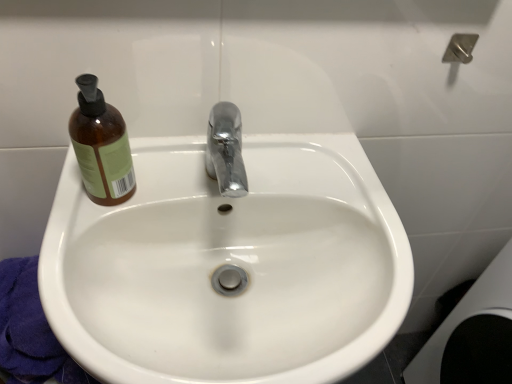
Question: From a real-world perspective, is white glossy sink at center beneath brown glass bottle at upper left?

Choices:
 (A) yes
 (B) no

Answer: (A)

Question: Could you tell me if white glossy sink at center is turned towards brown glass bottle at upper left?

Choices:
 (A) no
 (B) yes

Answer: (A)

Question: Does white glossy sink at center appear on the left side of brown glass bottle at upper left?

Choices:
 (A) yes
 (B) no

Answer: (B)

Question: Can you confirm if white glossy sink at center is thinner than brown glass bottle at upper left?

Choices:
 (A) no
 (B) yes

Answer: (A)

Question: Is white glossy sink at center to the right of brown glass bottle at upper left from the viewer's perspective?

Choices:
 (A) no
 (B) yes

Answer: (B)

Question: Can we say white glossy sink at center lies outside brown glass bottle at upper left?

Choices:
 (A) yes
 (B) no

Answer: (A)

Question: Can you confirm if brown glass bottle at upper left is thinner than white glossy sink at center?

Choices:
 (A) no
 (B) yes

Answer: (B)

Question: Does brown glass bottle at upper left have a greater width compared to white glossy sink at center?

Choices:
 (A) yes
 (B) no

Answer: (B)

Question: From the image's perspective, is brown glass bottle at upper left below white glossy sink at center?

Choices:
 (A) yes
 (B) no

Answer: (B)

Question: Does brown glass bottle at upper left have a lesser height compared to white glossy sink at center?

Choices:
 (A) no
 (B) yes

Answer: (A)

Question: Is brown glass bottle at upper left oriented away from white glossy sink at center?

Choices:
 (A) no
 (B) yes

Answer: (A)

Question: Is brown glass bottle at upper left aimed at white glossy sink at center?

Choices:
 (A) no
 (B) yes

Answer: (A)

Question: Is white glossy sink at center in front of or behind brown glass bottle at upper left in the image?

Choices:
 (A) behind
 (B) front

Answer: (B)